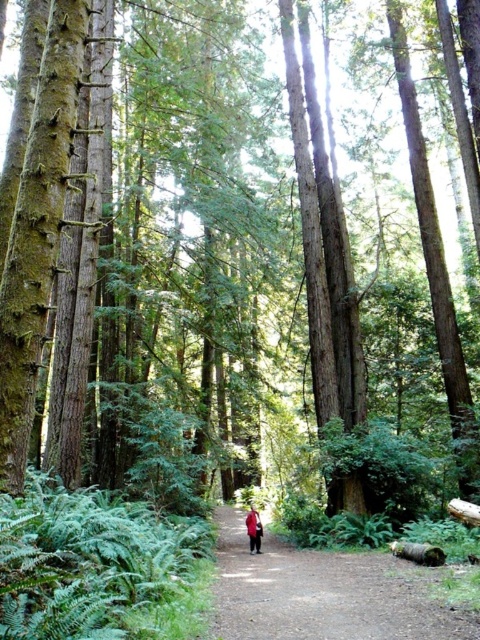
You are a hiker navigating through the forest. You see the dirt path at center and the red fabric coat at center. Which object is positioned to the right of the other?

The dirt path at center is to the right of the red fabric coat at center.

You are a hiker who wants to walk along the dirt path at center without stepping on the red fabric coat at center. Can you walk over it?

The dirt path at center is much taller than the red fabric coat at center, so you can walk over it easily without stepping on the coat.